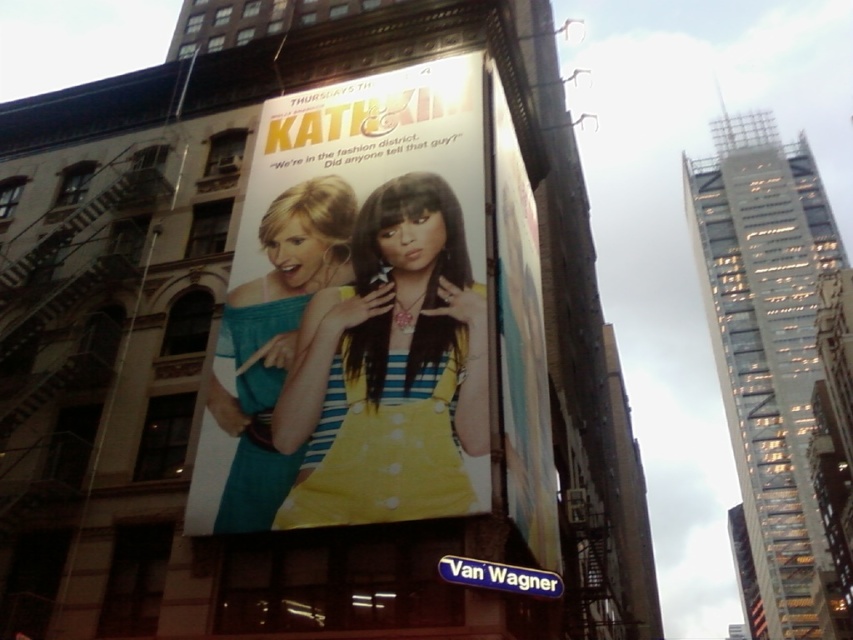
Between matte paper poster at center and yellow striped dress at center, which one appears on the right side from the viewer's perspective?

Positioned to the right is matte paper poster at center.

From the picture: Can you confirm if matte paper poster at center is taller than yellow striped dress at center?

Correct, matte paper poster at center is much taller as yellow striped dress at center.

Does point (367, 259) come behind point (422, 240)?

Yes, point (367, 259) is behind point (422, 240).

Locate an element on the screen. matte paper poster at center is located at coordinates (360, 308).

Between point (445, 444) and point (285, 307), which one is positioned behind?

The point (285, 307) is more distant.

Can you confirm if yellow striped dress at center is bigger than teal fabric dress at center?

Indeed, yellow striped dress at center has a larger size compared to teal fabric dress at center.

What do you see at coordinates (389, 371) in the screenshot?
I see `yellow striped dress at center` at bounding box center [389, 371].

This screenshot has width=853, height=640. Find the location of `yellow striped dress at center`. yellow striped dress at center is located at coordinates (389, 371).

Is matte paper poster at center bigger than teal fabric dress at center?

Correct, matte paper poster at center is larger in size than teal fabric dress at center.

Is matte paper poster at center wider than teal fabric dress at center?

Indeed, matte paper poster at center has a greater width compared to teal fabric dress at center.

Between point (305, 148) and point (244, 502), which one is positioned behind?

The point (305, 148) is more distant.

I want to click on matte paper poster at center, so click(360, 308).